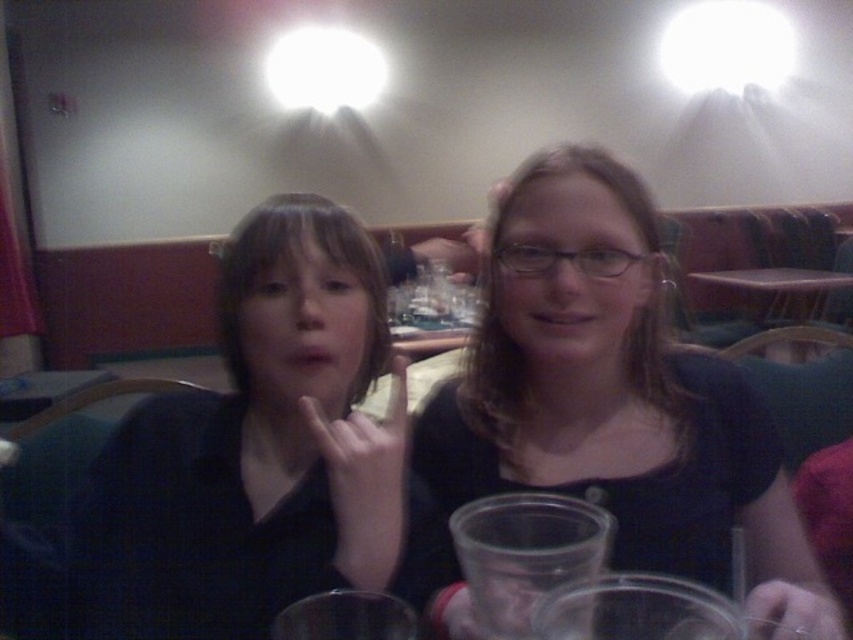
Is matte black shirt at center smaller than matte black shirt at left?

No, matte black shirt at center is not smaller than matte black shirt at left.

Can you confirm if matte black shirt at center is positioned to the right of matte black shirt at left?

Correct, you'll find matte black shirt at center to the right of matte black shirt at left.

Is point (772, 490) behind point (363, 356)?

Yes.

Identify the location of matte black shirt at center. This screenshot has height=640, width=853. (613, 396).

Is point (459, 556) behind point (827, 275)?

No, it is in front of (827, 275).

Does transparent glass at lower center appear on the left side of purple plastic table at center?

Indeed, transparent glass at lower center is positioned on the left side of purple plastic table at center.

Is point (537, 531) closer to viewer compared to point (791, 272)?

That is True.

Identify the location of transparent glass at lower center. This screenshot has height=640, width=853. (524, 554).

Is point (131, 474) in front of point (543, 561)?

That is False.

Which is more to the left, matte black shirt at left or transparent glass at lower center?

matte black shirt at left

Between point (344, 406) and point (454, 540), which one is positioned in front?

Point (454, 540)

This screenshot has height=640, width=853. I want to click on matte black shirt at left, so click(x=238, y=444).